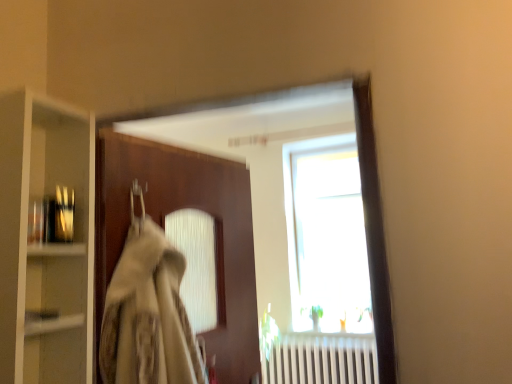
Question: Can you confirm if metallic glass bottles at left is wider than clear glass cabinet at left?

Choices:
 (A) no
 (B) yes

Answer: (A)

Question: From a real-world perspective, is metallic glass bottles at left positioned over clear glass cabinet at left based on gravity?

Choices:
 (A) no
 (B) yes

Answer: (B)

Question: Is the position of metallic glass bottles at left less distant than that of clear glass cabinet at left?

Choices:
 (A) yes
 (B) no

Answer: (B)

Question: Can clear glass cabinet at left be found inside metallic glass bottles at left?

Choices:
 (A) yes
 (B) no

Answer: (B)

Question: Is metallic glass bottles at left at the right side of clear glass cabinet at left?

Choices:
 (A) yes
 (B) no

Answer: (A)

Question: From a real-world perspective, relative to clear glass cabinet at left, is metallic glass bottles at left vertically above or below?

Choices:
 (A) below
 (B) above

Answer: (B)

Question: Is point (33, 244) positioned closer to the camera than point (59, 180)?

Choices:
 (A) farther
 (B) closer

Answer: (B)

Question: Looking at their shapes, would you say metallic glass bottles at left is wider or thinner than clear glass cabinet at left?

Choices:
 (A) thin
 (B) wide

Answer: (A)

Question: In the image, is metallic glass bottles at left on the left side or the right side of clear glass cabinet at left?

Choices:
 (A) right
 (B) left

Answer: (A)

Question: Considering the positions of point (219, 291) and point (29, 375), is point (219, 291) closer or farther from the camera than point (29, 375)?

Choices:
 (A) closer
 (B) farther

Answer: (B)

Question: Based on their positions, is brown wooden door at center located to the left or right of clear glass cabinet at left?

Choices:
 (A) right
 (B) left

Answer: (A)

Question: Considering the positions of brown wooden door at center and clear glass cabinet at left in the image, is brown wooden door at center wider or thinner than clear glass cabinet at left?

Choices:
 (A) wide
 (B) thin

Answer: (B)

Question: In terms of size, does brown wooden door at center appear bigger or smaller than clear glass cabinet at left?

Choices:
 (A) small
 (B) big

Answer: (B)

Question: In terms of size, does brown wooden door at center appear bigger or smaller than metallic glass bottles at left?

Choices:
 (A) big
 (B) small

Answer: (A)

Question: Considering the relative positions of brown wooden door at center and metallic glass bottles at left in the image provided, is brown wooden door at center to the left or to the right of metallic glass bottles at left?

Choices:
 (A) left
 (B) right

Answer: (B)